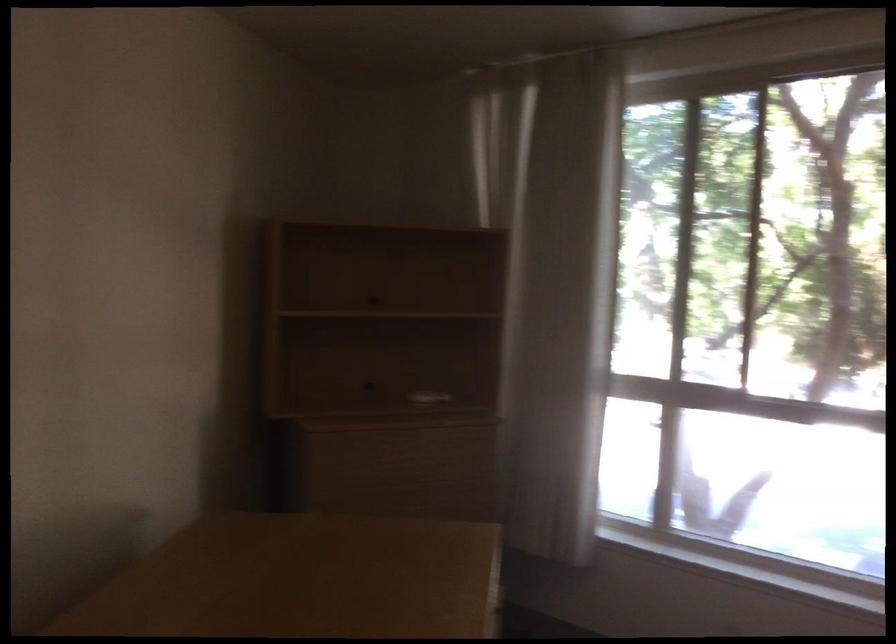
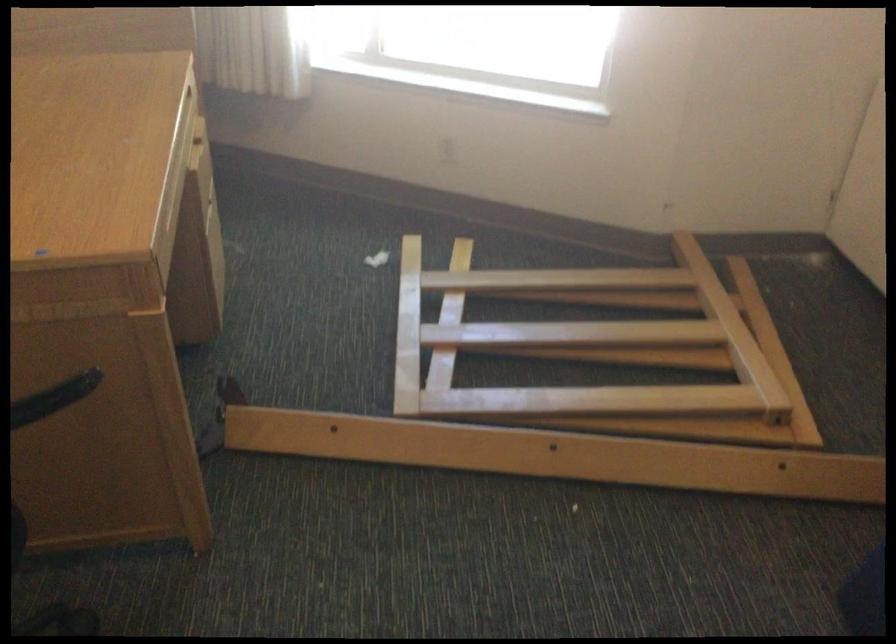
Based on the continuous images, in which direction is the camera rotating?

The camera's rotation is toward right-down.